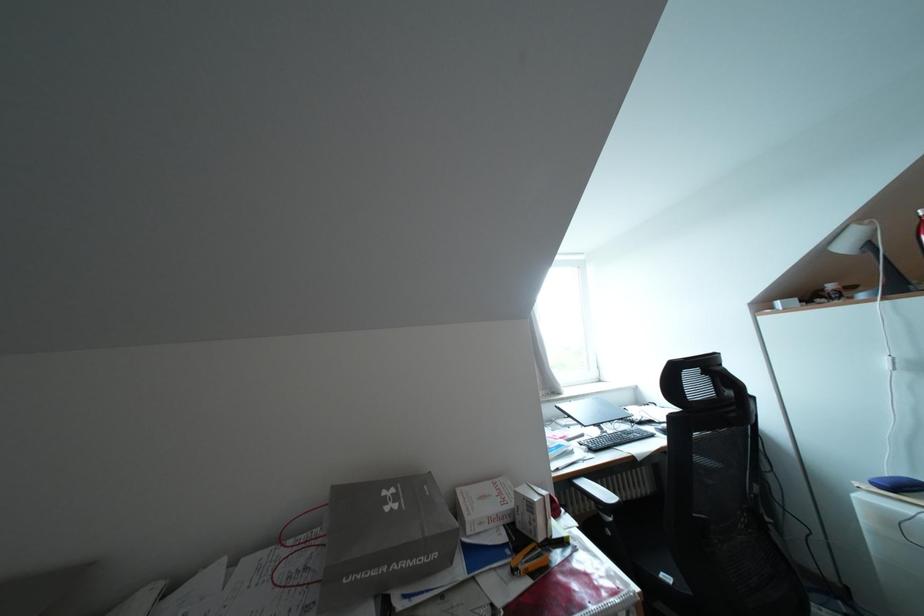
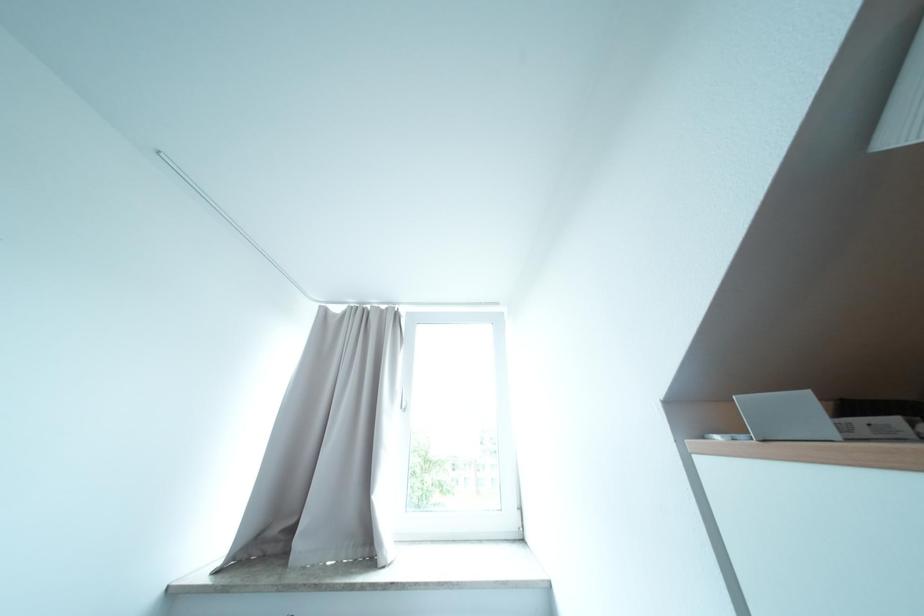
Which direction would the cameraman need to move to produce the second image?

The cameraman walked toward right, forward.